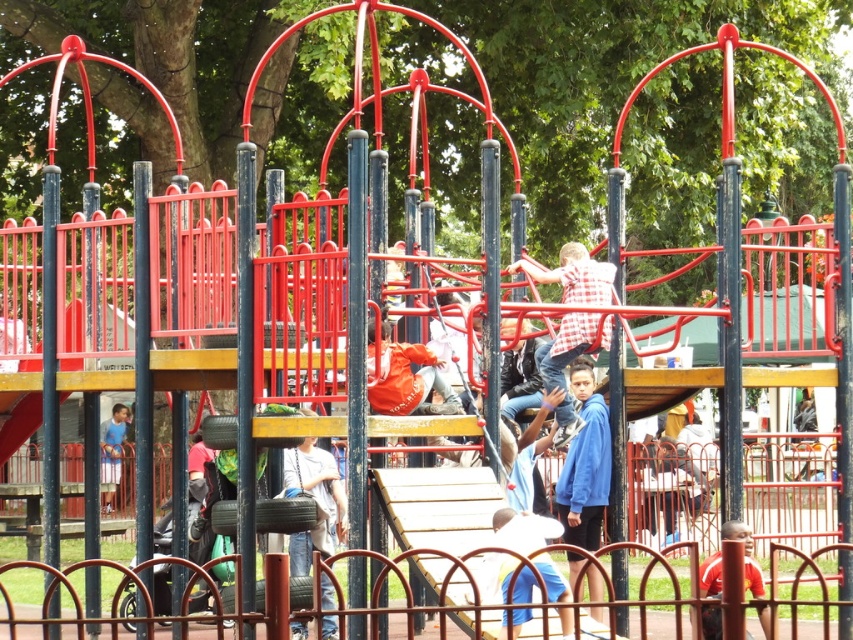
Does white cotton shirt at lower center come behind red shirt at lower right?

Yes, white cotton shirt at lower center is further from the viewer.

Between white cotton shirt at lower center and red shirt at lower right, which one is positioned lower?

red shirt at lower right

Between point (509, 524) and point (699, 568), which one is positioned in front?

Point (509, 524) is in front.

You are a GUI agent. You are given a task and a screenshot of the screen. Output one action in this format:
    pyautogui.click(x=<x>, y=<y>)
    Task: Click on the white cotton shirt at lower center
    
    Given the screenshot: What is the action you would take?
    pyautogui.click(x=523, y=531)

The height and width of the screenshot is (640, 853). Describe the element at coordinates (585, 465) in the screenshot. I see `blue fleece jacket at lower right` at that location.

Measure the distance between blue fleece jacket at lower right and blue fabric shirt at center.

They are 38.50 meters apart.

Between point (592, 522) and point (126, 417), which one is positioned behind?

The point (126, 417) is more distant.

Where is `blue fleece jacket at lower right`? The image size is (853, 640). blue fleece jacket at lower right is located at coordinates (585, 465).

In the scene shown: Who is higher up, blue fleece jacket at lower right or white cotton shirt at center?

white cotton shirt at center

Describe the element at coordinates (585, 465) in the screenshot. I see `blue fleece jacket at lower right` at that location.

What do you see at coordinates (585, 465) in the screenshot?
I see `blue fleece jacket at lower right` at bounding box center [585, 465].

The height and width of the screenshot is (640, 853). I want to click on blue fleece jacket at lower right, so click(x=585, y=465).